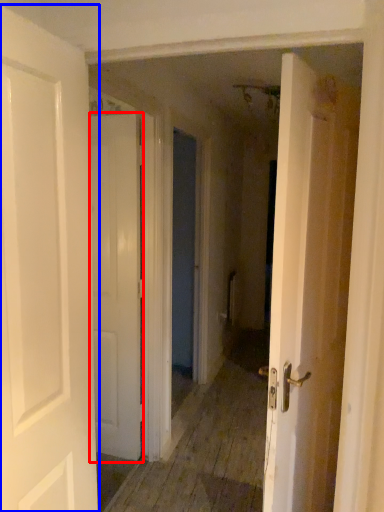
Question: Among these objects, which one is nearest to the camera, door (highlighted by a red box) or door (highlighted by a blue box)?

Choices:
 (A) door
 (B) door

Answer: (B)